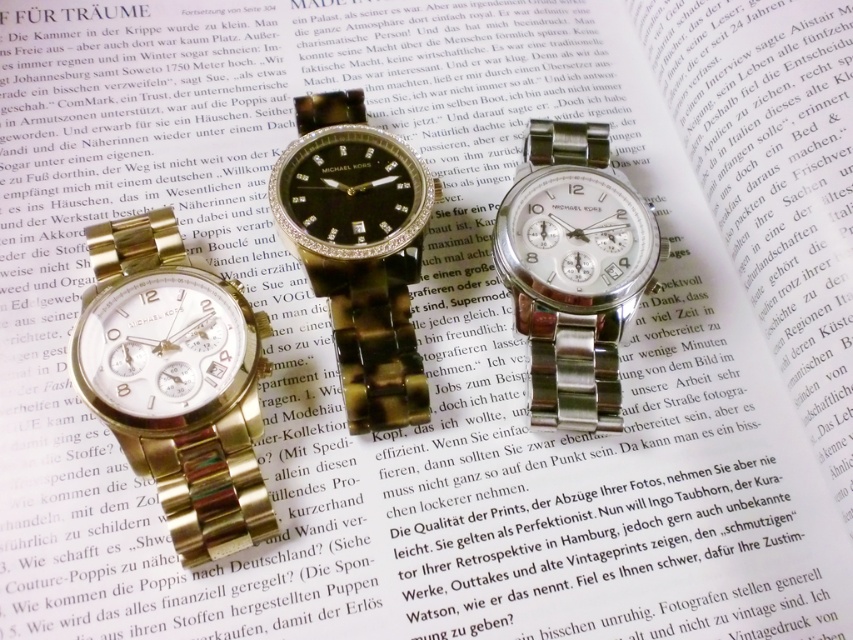
Question: Which point appears closest to the camera in this image?

Choices:
 (A) (567, 129)
 (B) (206, 291)

Answer: (B)

Question: Which object appears farthest from the camera in this image?

Choices:
 (A) satin silver watch at center
 (B) gold metallic watch at left
 (C) black crystal watch at center

Answer: (A)

Question: Does black crystal watch at center have a larger size compared to satin silver watch at center?

Choices:
 (A) yes
 (B) no

Answer: (A)

Question: In this image, where is gold metallic watch at left located relative to satin silver watch at center?

Choices:
 (A) left
 (B) right

Answer: (A)

Question: Observing the image, what is the correct spatial positioning of black crystal watch at center in reference to satin silver watch at center?

Choices:
 (A) below
 (B) above

Answer: (B)

Question: Estimate the real-world distances between objects in this image. Which object is closer to the black crystal watch at center?

Choices:
 (A) gold metallic watch at left
 (B) satin silver watch at center

Answer: (A)